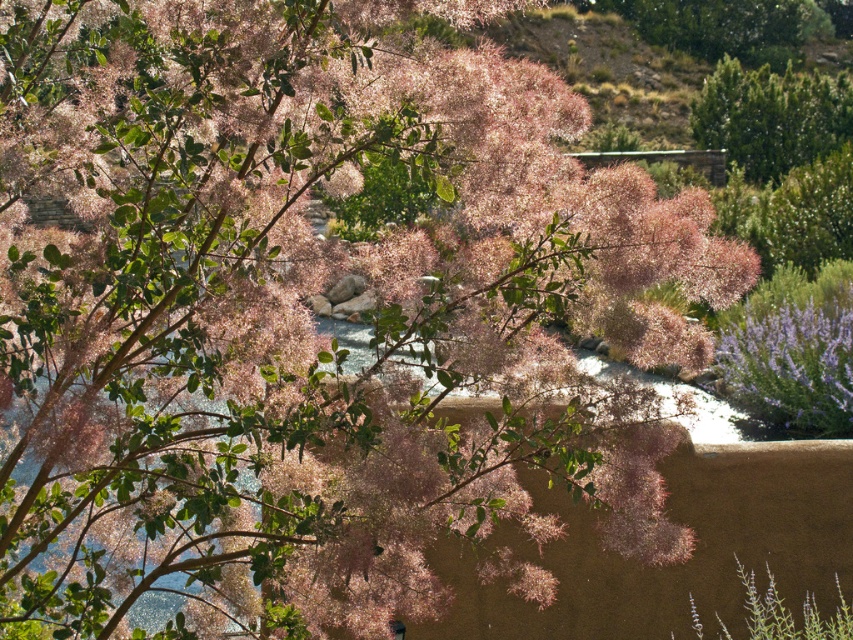
Question: Which point appears closest to the camera in this image?

Choices:
 (A) (799, 134)
 (B) (798, 356)

Answer: (B)

Question: Which of the following is the closest to the observer?

Choices:
 (A) (764, 72)
 (B) (793, 316)

Answer: (B)

Question: Does purple fuzzy bush at lower right lie behind green matte bush at upper right?

Choices:
 (A) yes
 (B) no

Answer: (B)

Question: Does purple fuzzy bush at lower right appear on the right side of green matte bush at upper right?

Choices:
 (A) yes
 (B) no

Answer: (B)

Question: Can you confirm if purple fuzzy bush at lower right is thinner than green matte bush at upper right?

Choices:
 (A) yes
 (B) no

Answer: (B)